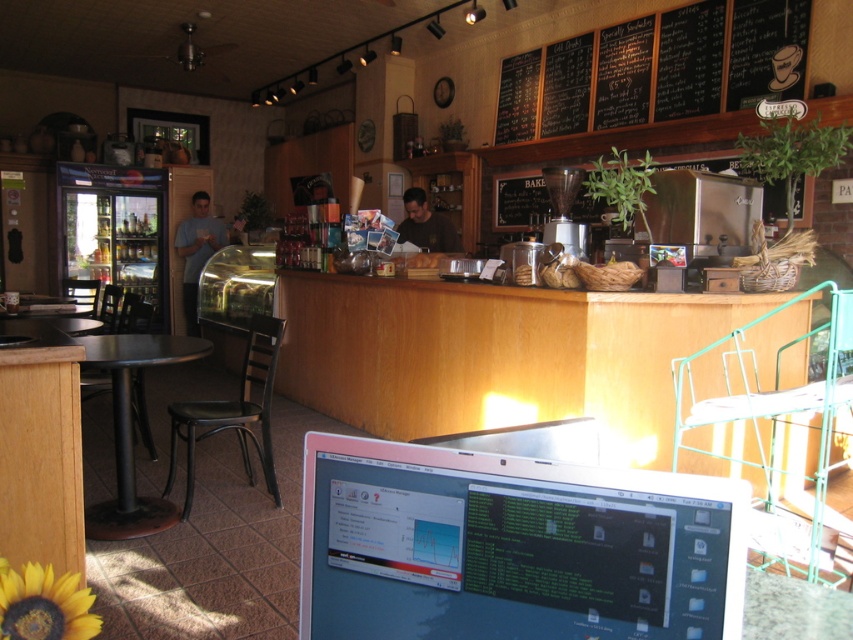
Question: Estimate the real-world distances between objects in this image. Which object is farther from the black metal table at left?

Choices:
 (A) satin silver laptop at lower center
 (B) black chalkboard menu at upper center

Answer: (B)

Question: Which of the following is the farthest from the observer?

Choices:
 (A) black chalkboard menu at upper center
 (B) satin silver laptop at lower center
 (C) black metal table at left

Answer: (A)

Question: Which object is the farthest from the satin silver laptop at lower center?

Choices:
 (A) black metal table at left
 (B) black chalkboard menu at upper center

Answer: (B)

Question: Does satin silver laptop at lower center have a lesser width compared to black metal table at left?

Choices:
 (A) yes
 (B) no

Answer: (A)

Question: Does satin silver laptop at lower center appear over black chalkboard menu at upper center?

Choices:
 (A) yes
 (B) no

Answer: (B)

Question: Where is black chalkboard menu at upper center located in relation to black metal table at left in the image?

Choices:
 (A) right
 (B) left

Answer: (A)